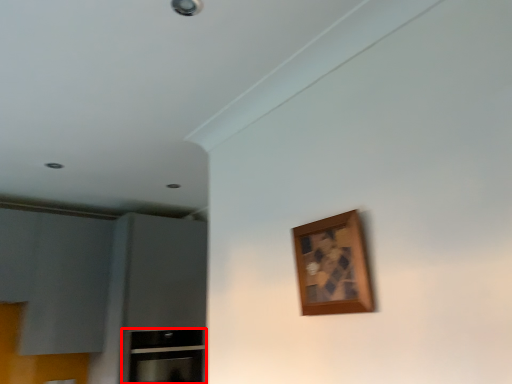
Question: From the image, what is the correct spatial relationship of cabinetry (annotated by the red box) in relation to picture frame?

Choices:
 (A) right
 (B) left

Answer: (B)